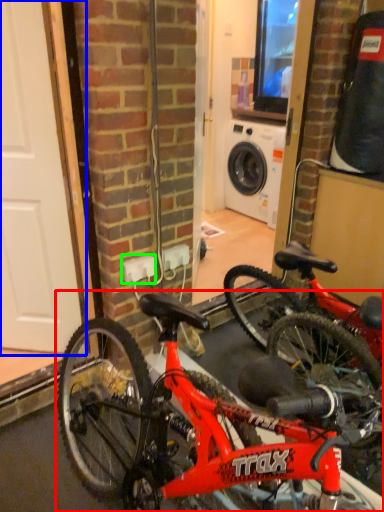
Question: Which is nearer to the bicycle (highlighted by a red box)? door (highlighted by a blue box) or electric outlet (highlighted by a green box).

Choices:
 (A) door
 (B) electric outlet

Answer: (B)